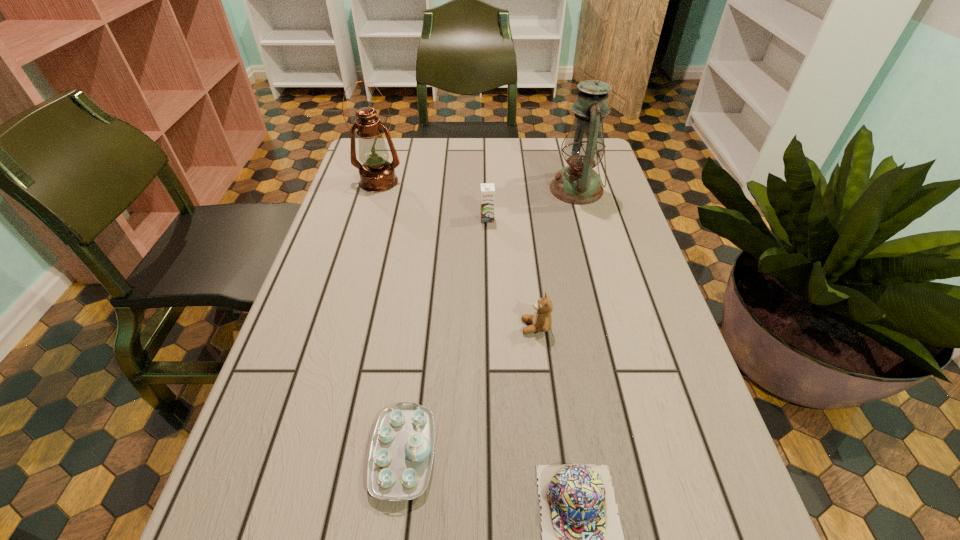
This screenshot has height=540, width=960. I want to click on free region located 0.120m on the front-facing side of the third nearest object, so click(x=465, y=327).

Image resolution: width=960 pixels, height=540 pixels. I want to click on vacant space located 0.160m on the front-facing side of the third nearest object, so click(445, 327).

Identify the location of free region located on the front-facing side of the third nearest object. (450, 327).

Identify the location of free region located 0.390m on the back of the chinaware. The width and height of the screenshot is (960, 540). (427, 262).

Where is `object at the left edge`? Image resolution: width=960 pixels, height=540 pixels. object at the left edge is located at coordinates (377, 174).

Locate an element on the screen. object located in the right edge section of the desktop is located at coordinates pos(578,183).

Locate an element on the screen. This screenshot has width=960, height=540. object at the far left corner is located at coordinates (377, 174).

Where is `object situated at the far right corner`? The height and width of the screenshot is (540, 960). object situated at the far right corner is located at coordinates (578, 183).

Where is `free point at the far edge`? The image size is (960, 540). free point at the far edge is located at coordinates (435, 171).

Locate an element on the screen. Image resolution: width=960 pixels, height=540 pixels. free space at the left edge of the desktop is located at coordinates 393,197.